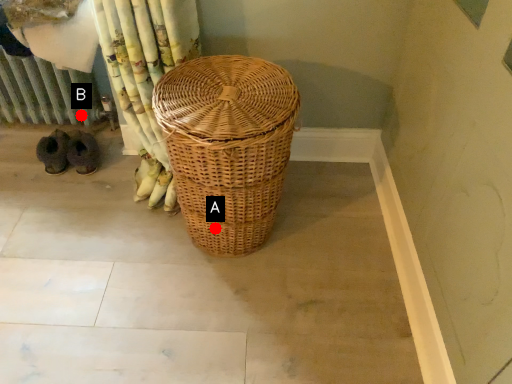
Question: Two points are circled on the image, labeled by A and B beside each circle. Among these points, which one is nearest to the camera?

Choices:
 (A) A is closer
 (B) B is closer

Answer: (A)